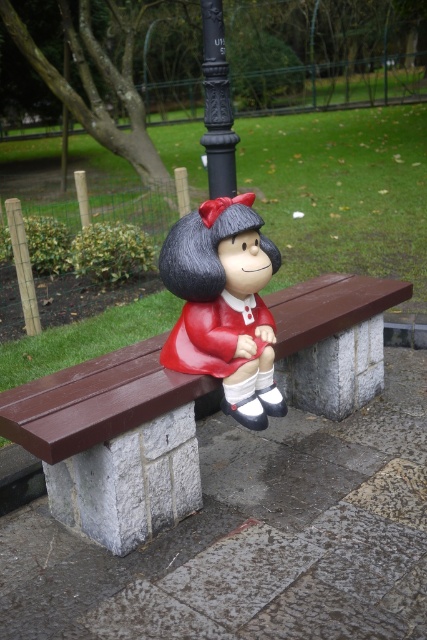
Question: Which of the following is the closest to the observer?

Choices:
 (A) (233, 144)
 (B) (266, 305)

Answer: (B)

Question: Among these objects, which one is nearest to the camera?

Choices:
 (A) black cast iron pole at upper center
 (B) matte red plastic figurine at center
 (C) brown wooden bench at center

Answer: (C)

Question: Is matte red plastic figurine at center in front of black cast iron pole at upper center?

Choices:
 (A) yes
 (B) no

Answer: (A)

Question: Is brown wooden bench at center positioned in front of black cast iron pole at upper center?

Choices:
 (A) no
 (B) yes

Answer: (B)

Question: Which of these objects is positioned farthest from the black cast iron pole at upper center?

Choices:
 (A) brown wooden bench at center
 (B) matte red plastic figurine at center

Answer: (A)

Question: Is brown wooden bench at center below black cast iron pole at upper center?

Choices:
 (A) yes
 (B) no

Answer: (A)